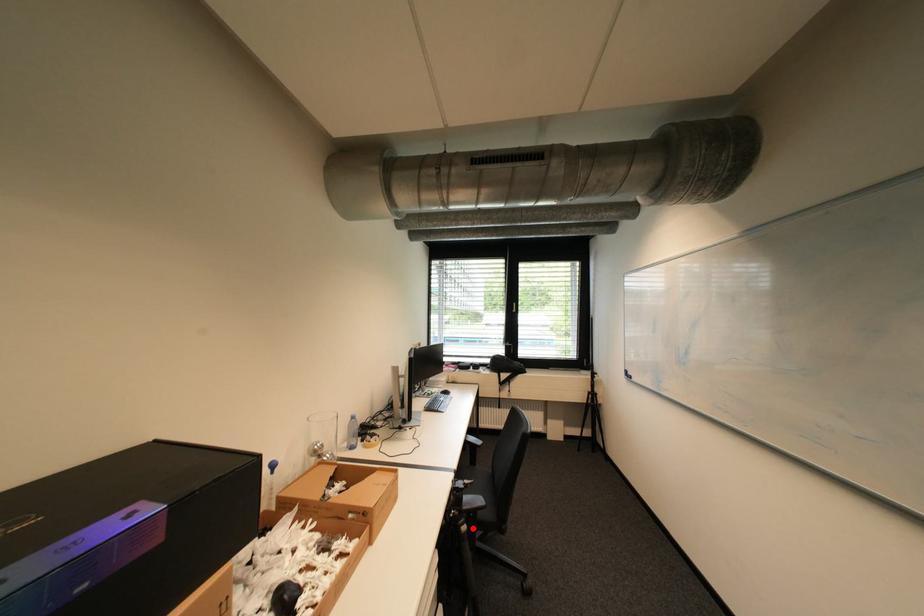
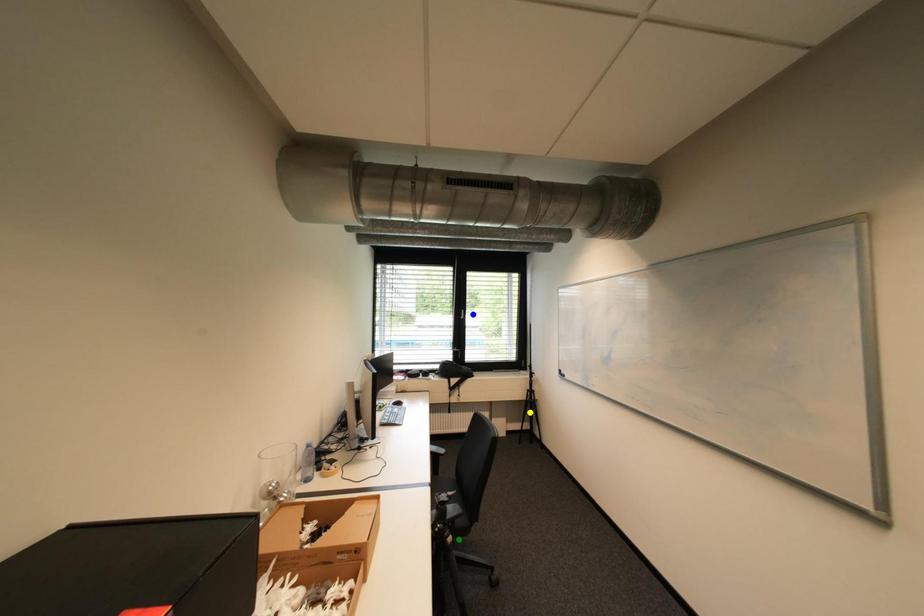
Question: I am providing you with two images of the same scene from different viewpoints. A red point is marked on the first image. You are given multiple points on the second image. In image 2, which mark is for the same physical point as the one in image 1?

Choices:
 (A) green point
 (B) blue point
 (C) yellow point

Answer: (A)